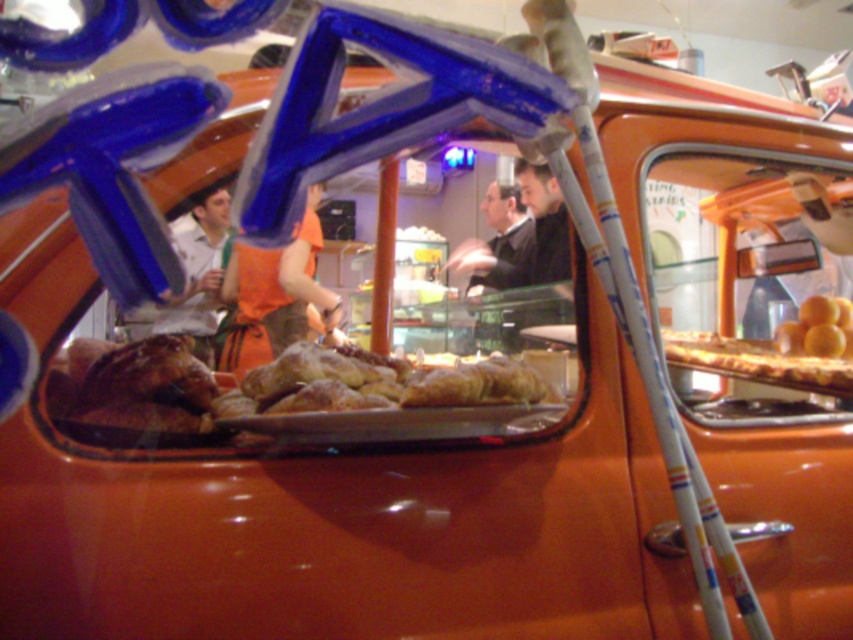
Is golden brown pastry at center to the right of dark suit at center from the viewer's perspective?

No, golden brown pastry at center is not to the right of dark suit at center.

Does golden brown pastry at center come in front of dark suit at center?

Yes, golden brown pastry at center is in front of dark suit at center.

Locate an element on the screen. The width and height of the screenshot is (853, 640). golden brown pastry at center is located at coordinates (375, 384).

Which is above, dark suit at center or yellow matte oranges at right?

dark suit at center is above.

Is dark suit at center further to the viewer compared to yellow matte oranges at right?

Yes, it is behind yellow matte oranges at right.

Is point (529, 216) closer to camera compared to point (824, 324)?

No, it is behind (824, 324).

Identify the location of dark suit at center. This screenshot has width=853, height=640. click(x=496, y=237).

This screenshot has width=853, height=640. I want to click on golden brown pastry at center, so click(x=375, y=384).

Between golden brown pastry at center and yellow matte oranges at right, which one has more height?

With more height is yellow matte oranges at right.

Who is more distant from viewer, [422,397] or [837,346]?

The point [837,346] is behind.

This screenshot has height=640, width=853. What are the coordinates of `golden brown pastry at center` in the screenshot? It's located at (375, 384).